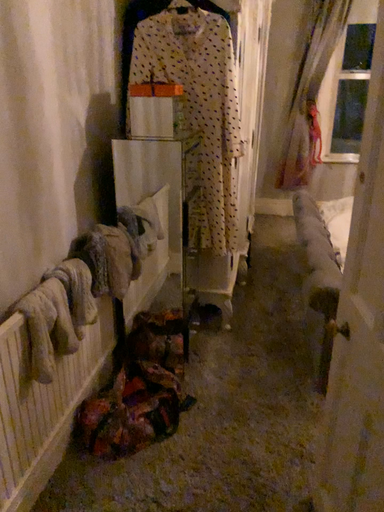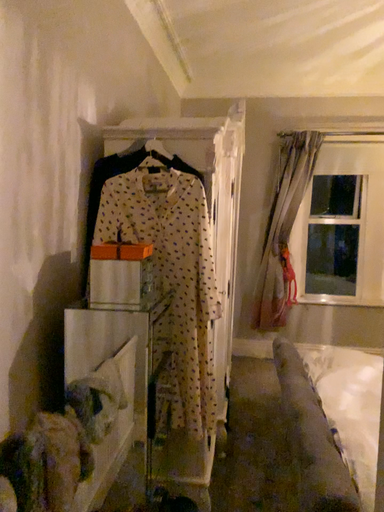
Question: How did the camera likely rotate when shooting the video?

Choices:
 (A) rotated downward
 (B) rotated upward

Answer: (B)